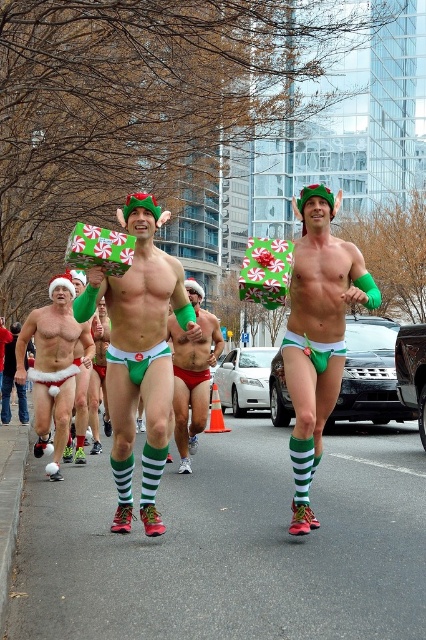
Question: Can you confirm if green matte underwear at center is positioned below matte green underwear at center?

Choices:
 (A) no
 (B) yes

Answer: (B)

Question: Can you confirm if green matte underwear at center is positioned to the left of green striped socks at left?

Choices:
 (A) no
 (B) yes

Answer: (A)

Question: Can you confirm if green matte underwear at center is positioned below green striped socks at left?

Choices:
 (A) no
 (B) yes

Answer: (B)

Question: Estimate the real-world distances between objects in this image. Which object is farther from the green matte underwear at center?

Choices:
 (A) green matte socks at center
 (B) matte green fabric gift at center
 (C) green striped socks at left
 (D) matte green underwear at center

Answer: (A)

Question: Which point is closer to the camera?

Choices:
 (A) (161, 332)
 (B) (52, 340)
 (C) (155, 275)

Answer: (C)

Question: Which of the following is the farthest from the observer?

Choices:
 (A) (324, 406)
 (B) (330, 285)
 (C) (51, 464)
 (D) (198, 356)

Answer: (D)